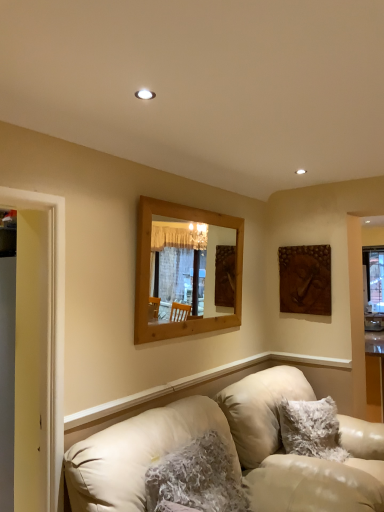
At what (x,y) coordinates should I click in order to perform the action: click on yellow wood door frame at left. Please return your answer as a coordinate pair (x, y). This screenshot has height=512, width=384. Looking at the image, I should click on (51, 328).

Describe the element at coordinates (305, 279) in the screenshot. I see `brown textured wall art at upper right` at that location.

What is the approximate width of fuzzy white pillow at lower right, placed as the 2th pillow when sorted from left to right?

fuzzy white pillow at lower right, placed as the 2th pillow when sorted from left to right, is 27.84 centimeters in width.

You are a GUI agent. You are given a task and a screenshot of the screen. Output one action in this format:
    pyautogui.click(x=<x>, y=<y>)
    Task: Click on the yellow wood door frame at left
    This screenshot has width=384, height=512.
    Given the screenshot: What is the action you would take?
    pyautogui.click(x=51, y=328)

From the image's perspective, is leather couch at lower left positioned above or below brown textured wall art at upper right?

From the image's perspective, leather couch at lower left appears below brown textured wall art at upper right.

What's the angular difference between leather couch at lower left and brown textured wall art at upper right's facing directions?

90.2 degrees separate the facing orientations of leather couch at lower left and brown textured wall art at upper right.

Is point (136, 465) closer to viewer compared to point (294, 308)?

Yes.

Does fuzzy white pillow at lower right, marked as the first pillow in a back-to-front arrangement, have a lesser height compared to brown textured wall art at upper right?

Yes, fuzzy white pillow at lower right, marked as the first pillow in a back-to-front arrangement, is shorter than brown textured wall art at upper right.

Is fuzzy white pillow at lower right, which is counted as the 1th pillow, starting from the right, beside brown textured wall art at upper right?

No, fuzzy white pillow at lower right, which is counted as the 1th pillow, starting from the right, is not making contact with brown textured wall art at upper right.

Can you confirm if fuzzy white pillow at lower right, placed as the second pillow when sorted from front to back, is wider than brown textured wall art at upper right?

Correct, the width of fuzzy white pillow at lower right, placed as the second pillow when sorted from front to back, exceeds that of brown textured wall art at upper right.

From a real-world perspective, is fuzzy white pillow at lower right, marked as the first pillow in a back-to-front arrangement, located higher than brown textured wall art at upper right?

Incorrect, from a real-world perspective, fuzzy white pillow at lower right, marked as the first pillow in a back-to-front arrangement, is lower than brown textured wall art at upper right.

Between leather couch at lower left and fuzzy white pillow at lower right, placed as the second pillow when sorted from front to back, which one appears on the left side from the viewer's perspective?

leather couch at lower left is more to the left.

Which of these two, leather couch at lower left or fuzzy white pillow at lower right, which is counted as the 1th pillow, starting from the right, stands taller?

leather couch at lower left is taller.

Is leather couch at lower left positioned far away from fuzzy white pillow at lower right, placed as the second pillow when sorted from front to back?

No, leather couch at lower left is not far from fuzzy white pillow at lower right, placed as the second pillow when sorted from front to back.

The image size is (384, 512). In the image, there is a fuzzy white pillow at lower right, placed as the second pillow when sorted from front to back. What are the coordinates of `studio couch below it (from the image's perspective)` in the screenshot? It's located at (232, 451).

Considering the sizes of objects fuzzy white pillow at lower center, which appears as the 1th pillow when viewed from the front, and brown textured wall art at upper right in the image provided, who is wider, fuzzy white pillow at lower center, which appears as the 1th pillow when viewed from the front, or brown textured wall art at upper right?

Wider between the two is fuzzy white pillow at lower center, which appears as the 1th pillow when viewed from the front.

From the image's perspective, is fuzzy white pillow at lower center, the second pillow from the back, located above brown textured wall art at upper right?

No.

Is fuzzy white pillow at lower center, marked as the first pillow in a left-to-right arrangement, bigger than brown textured wall art at upper right?

Indeed, fuzzy white pillow at lower center, marked as the first pillow in a left-to-right arrangement, has a larger size compared to brown textured wall art at upper right.

Is leather couch at lower left at the back of fuzzy white pillow at lower center, which appears as the 1th pillow when viewed from the front?

Absolutely, fuzzy white pillow at lower center, which appears as the 1th pillow when viewed from the front, is directed away from leather couch at lower left.

Is fuzzy white pillow at lower center, the second pillow from the back, inside or outside of leather couch at lower left?

fuzzy white pillow at lower center, the second pillow from the back, can be found inside leather couch at lower left.

Which object is further away from the camera taking this photo, fuzzy white pillow at lower center, which appears as the 1th pillow when viewed from the front, or leather couch at lower left?

fuzzy white pillow at lower center, which appears as the 1th pillow when viewed from the front, is further away from the camera.

You are a GUI agent. You are given a task and a screenshot of the screen. Output one action in this format:
    pyautogui.click(x=<x>, y=<y>)
    Task: Click on the pillow that is the 2nd object located above the leather couch at lower left (from the image's perspective)
    This screenshot has height=512, width=384.
    Given the screenshot: What is the action you would take?
    pyautogui.click(x=196, y=479)

Is yellow wood door frame at left situated inside wooden mirror at center or outside?

yellow wood door frame at left is spatially situated outside wooden mirror at center.

Between yellow wood door frame at left and wooden mirror at center, which one appears on the right side from the viewer's perspective?

wooden mirror at center is more to the right.

Considering the relative sizes of yellow wood door frame at left and wooden mirror at center in the image provided, is yellow wood door frame at left smaller than wooden mirror at center?

Correct, yellow wood door frame at left occupies less space than wooden mirror at center.

In the scene shown: From the image's perspective, is yellow wood door frame at left located above wooden mirror at center?

No, from the image's perspective, yellow wood door frame at left is not over wooden mirror at center.

Can you tell me how much brown textured wall art at upper right and wooden mirror at center differ in facing direction?

The angular difference between brown textured wall art at upper right and wooden mirror at center is 90.2 degrees.

Is brown textured wall art at upper right to the left of wooden mirror at center from the viewer's perspective?

No, brown textured wall art at upper right is not to the left of wooden mirror at center.

Does point (319, 293) appear closer or farther from the camera than point (181, 284)?

Point (319, 293) is positioned closer to the camera compared to point (181, 284).

Identify the location of studio couch lying below the brown textured wall art at upper right (from the image's perspective). The image size is (384, 512). (232, 451).

From the brown textured wall art at upper right, count the 1st pillow to the left and point to it. Please provide its 2D coordinates.

[(311, 429)]

When comparing their distances from wooden mirror at center, does fuzzy white pillow at lower center, which ranks as the second pillow in right-to-left order, or brown textured wall art at upper right seem further?

fuzzy white pillow at lower center, which ranks as the second pillow in right-to-left order.

Looking at the image, which one is located closer to brown textured wall art at upper right, fuzzy white pillow at lower center, which appears as the 1th pillow when viewed from the front, or leather couch at lower left?

Among the two, leather couch at lower left is located nearer to brown textured wall art at upper right.

In the scene shown: Considering their positions, is brown textured wall art at upper right positioned further to leather couch at lower left than wooden mirror at center?

wooden mirror at center is further to leather couch at lower left.

When comparing their distances from leather couch at lower left, does yellow wood door frame at left or wooden mirror at center seem closer?

Based on the image, yellow wood door frame at left appears to be nearer to leather couch at lower left.

Estimate the real-world distances between objects in this image. Which object is closer to brown textured wall art at upper right, fuzzy white pillow at lower center, the second pillow from the back, or fuzzy white pillow at lower right, which is counted as the 1th pillow, starting from the right?

Based on the image, fuzzy white pillow at lower right, which is counted as the 1th pillow, starting from the right, appears to be nearer to brown textured wall art at upper right.

In the scene shown: Estimate the real-world distances between objects in this image. Which object is further from fuzzy white pillow at lower right, marked as the first pillow in a back-to-front arrangement, leather couch at lower left or brown textured wall art at upper right?

brown textured wall art at upper right is further to fuzzy white pillow at lower right, marked as the first pillow in a back-to-front arrangement.

From the image, which object appears to be farther from wooden mirror at center, leather couch at lower left or yellow wood door frame at left?

yellow wood door frame at left is positioned further to the anchor wooden mirror at center.

From the picture: Looking at the image, which one is located closer to fuzzy white pillow at lower right, placed as the second pillow when sorted from front to back, brown textured wall art at upper right or wooden mirror at center?

Based on the image, brown textured wall art at upper right appears to be nearer to fuzzy white pillow at lower right, placed as the second pillow when sorted from front to back.

I want to click on pillow between yellow wood door frame at left and fuzzy white pillow at lower right, which is counted as the 1th pillow, starting from the right, so click(196, 479).

Where is `mirror between leather couch at lower left and brown textured wall art at upper right in the front-back direction`? This screenshot has height=512, width=384. mirror between leather couch at lower left and brown textured wall art at upper right in the front-back direction is located at coordinates (187, 264).

Locate an element on the screen. This screenshot has width=384, height=512. mirror between yellow wood door frame at left and brown textured wall art at upper right from front to back is located at coordinates (187, 264).

Identify the location of mirror positioned between fuzzy white pillow at lower center, which appears as the 1th pillow when viewed from the front, and brown textured wall art at upper right from near to far. This screenshot has height=512, width=384. (187, 264).